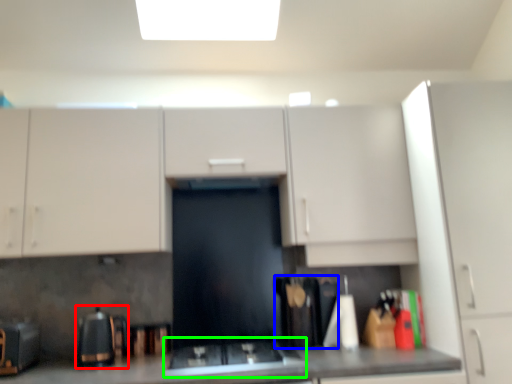
Question: Considering the real-world distances, which object is closest to appliance (highlighted by a red box)? appliance (highlighted by a blue box) or gas stove (highlighted by a green box).

Choices:
 (A) appliance
 (B) gas stove

Answer: (B)